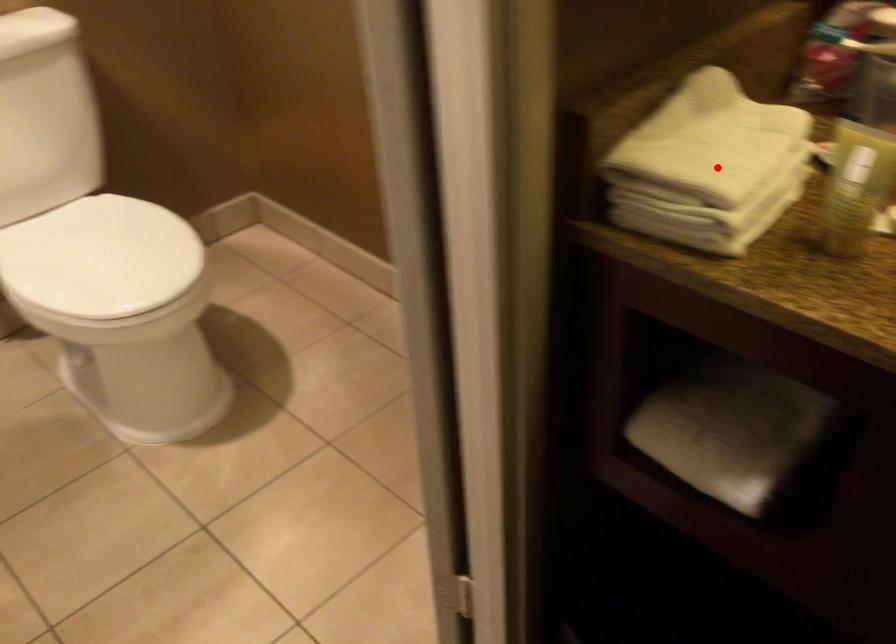
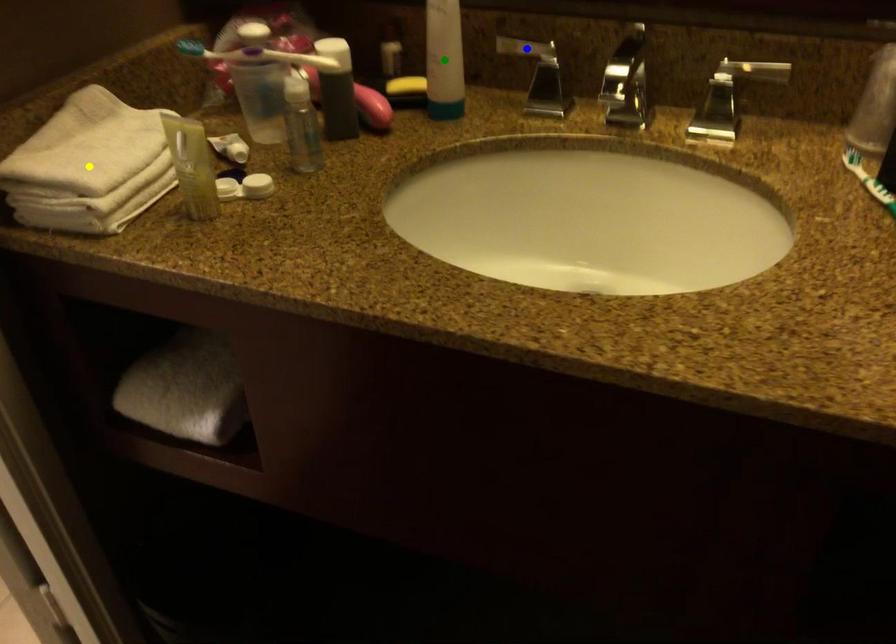
Question: I am providing you with two images of the same scene from different viewpoints. A red point is marked on the first image. You are given multiple points on the second image. Can you choose the point in image 2 that corresponds to the point in image 1?

Choices:
 (A) yellow point
 (B) green point
 (C) blue point

Answer: (A)